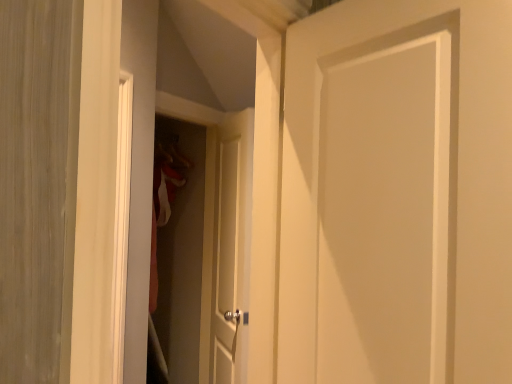
Question: From their relative heights in the image, would you say white matte door at center, the 1th door when ordered from front to back, is taller or shorter than matte white screen door at center?

Choices:
 (A) short
 (B) tall

Answer: (A)

Question: Considering their positions, is white matte door at center, placed as the second door when sorted from back to front, located in front of or behind matte white screen door at center?

Choices:
 (A) front
 (B) behind

Answer: (A)

Question: Based on their relative distances, which object is farther from the white matte door at center, acting as the 1th door starting from the right?

Choices:
 (A) white matte door at center, the 2th door positioned from the front
 (B) matte white screen door at center

Answer: (B)

Question: Which of these objects is positioned closest to the matte white screen door at center?

Choices:
 (A) white matte door at center, the 1th door in the back-to-front sequence
 (B) white matte door at center, arranged as the second door when viewed from the left

Answer: (A)